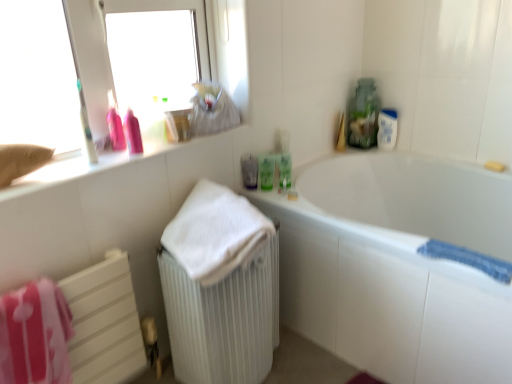
Question: Is white plastic bottle at upper right inside white ribbed radiator at lower left?

Choices:
 (A) no
 (B) yes

Answer: (A)

Question: Is white ribbed radiator at lower left bigger than white plastic bottle at upper right?

Choices:
 (A) yes
 (B) no

Answer: (A)

Question: Considering the relative sizes of white ribbed radiator at lower left and white plastic bottle at upper right in the image provided, is white ribbed radiator at lower left taller than white plastic bottle at upper right?

Choices:
 (A) no
 (B) yes

Answer: (B)

Question: Can you confirm if white ribbed radiator at lower left is thinner than white plastic bottle at upper right?

Choices:
 (A) yes
 (B) no

Answer: (B)

Question: Is white ribbed radiator at lower left not near white plastic bottle at upper right?

Choices:
 (A) yes
 (B) no

Answer: (A)

Question: Can you confirm if white ribbed radiator at lower left is positioned to the left of white plastic bottle at upper right?

Choices:
 (A) no
 (B) yes

Answer: (B)

Question: Can you confirm if white ribbed radiator at lower left is positioned to the left of green matte bottle at upper right, which is the 3th mouthwash from left to right?

Choices:
 (A) no
 (B) yes

Answer: (B)

Question: Can you confirm if white ribbed radiator at lower left is shorter than green matte bottle at upper right, which is the first mouthwash in right-to-left order?

Choices:
 (A) no
 (B) yes

Answer: (A)

Question: Would you say white ribbed radiator at lower left is a long distance from green matte bottle at upper right, which is the first mouthwash in right-to-left order?

Choices:
 (A) yes
 (B) no

Answer: (B)

Question: Can you confirm if white ribbed radiator at lower left is wider than green matte bottle at upper right, which is the 3th mouthwash from left to right?

Choices:
 (A) no
 (B) yes

Answer: (B)

Question: From a real-world perspective, is white ribbed radiator at lower left located higher than green matte bottle at upper right, which is the 3th mouthwash from left to right?

Choices:
 (A) no
 (B) yes

Answer: (A)

Question: Is white ribbed radiator at lower left to the right of green matte bottle at upper right, which is the 3th mouthwash from left to right, from the viewer's perspective?

Choices:
 (A) yes
 (B) no

Answer: (B)

Question: Is the position of matte white counter at upper left less distant than that of blue textured bath towel at lower right, marked as the 3th bath towel in a left-to-right arrangement?

Choices:
 (A) yes
 (B) no

Answer: (B)